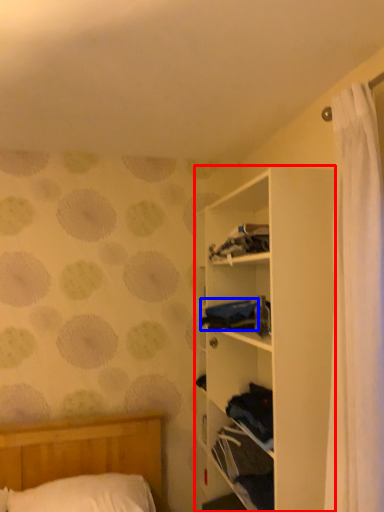
Question: Among these objects, which one is farthest to the camera, shelf (highlighted by a red box) or clothing (highlighted by a blue box)?

Choices:
 (A) shelf
 (B) clothing

Answer: (B)